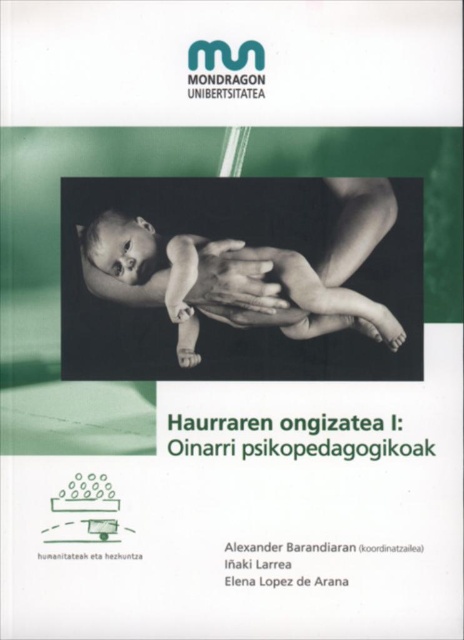
Is smooth skin baby at center in front of matte skin hand at center?

Yes.

Does smooth skin baby at center have a greater width compared to matte skin hand at center?

Yes.

You are a GUI agent. You are given a task and a screenshot of the screen. Output one action in this format:
    pyautogui.click(x=<x>, y=<y>)
    Task: Click on the smooth skin baby at center
    The height and width of the screenshot is (640, 464).
    Given the screenshot: What is the action you would take?
    pyautogui.click(x=229, y=298)

The width and height of the screenshot is (464, 640). Find the location of `smooth skin baby at center`. smooth skin baby at center is located at coordinates pos(229,298).